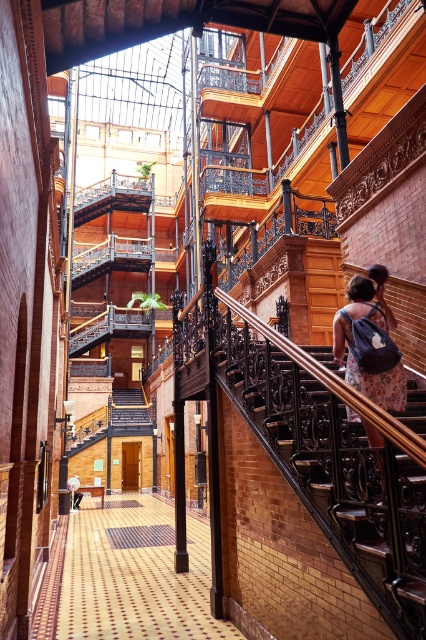
Does metallic grate at center have a greater height compared to light brown leather backpack at lower left?

In fact, metallic grate at center may be shorter than light brown leather backpack at lower left.

Can you confirm if metallic grate at center is positioned to the right of light brown leather backpack at lower left?

Correct, you'll find metallic grate at center to the right of light brown leather backpack at lower left.

Where is `metallic grate at center`? metallic grate at center is located at coordinates (140, 536).

Describe the element at coordinates (336, 474) in the screenshot. I see `polished brass stair at center` at that location.

Is point (313, 356) positioned behind point (74, 488)?

No, (313, 356) is closer to viewer.

Locate an element on the screen. The height and width of the screenshot is (640, 426). polished brass stair at center is located at coordinates (336, 474).

At what (x,y) coordinates should I click in order to perform the action: click on polished brass stair at center. Please return your answer as a coordinate pair (x, y). This screenshot has width=426, height=640. Looking at the image, I should click on (336, 474).

Based on the photo, can you confirm if floral fabric dress at center is positioned to the left of metallic grate at center?

In fact, floral fabric dress at center is to the right of metallic grate at center.

Between floral fabric dress at center and metallic grate at center, which one is positioned lower?

metallic grate at center

Describe the element at coordinates (354, 342) in the screenshot. Image resolution: width=426 pixels, height=640 pixels. I see `floral fabric dress at center` at that location.

At what (x,y) coordinates should I click in order to perform the action: click on floral fabric dress at center. Please return your answer as a coordinate pair (x, y). Image resolution: width=426 pixels, height=640 pixels. Looking at the image, I should click on coord(354,342).